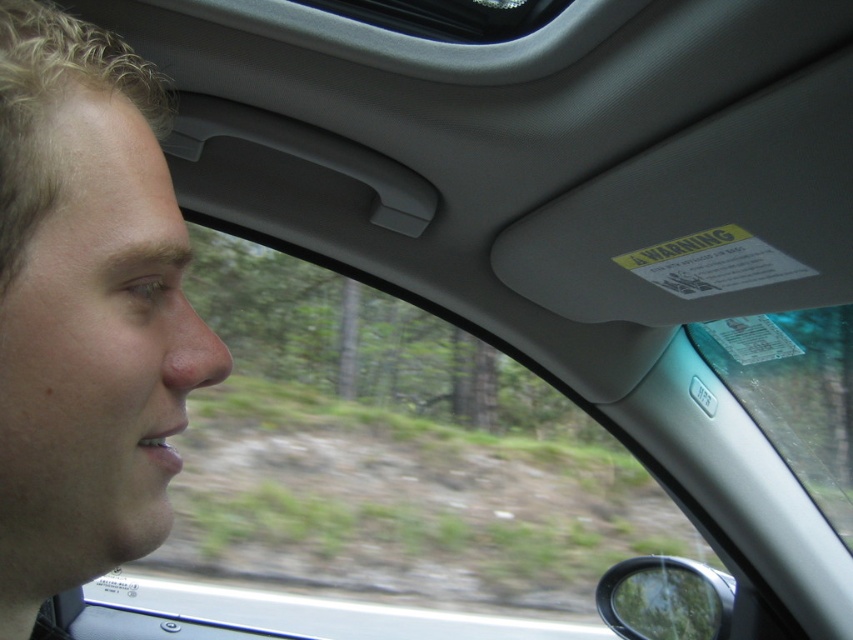
You are a passenger in a car and see the pale skin face at left in the rearview mirror. Is the face closer to the front or back of the car?

The pale skin face at left is located at point [85,310], which is closer to the front of the car since it is positioned near the left side of the interior.

Consider the image. You are sitting in the passenger seat of a car and notice a point marked at coordinates (x=85, y=310). What object in the car corresponds to this point?

The point at (x=85, y=310) corresponds to the pale skin face at left.

You are sitting in the passenger seat of the car and see two points marked in the image. Which point, point (x=149, y=456) or point (x=848, y=307), is closer to you?

Point (x=149, y=456) is closer to the viewer than point (x=848, y=307).